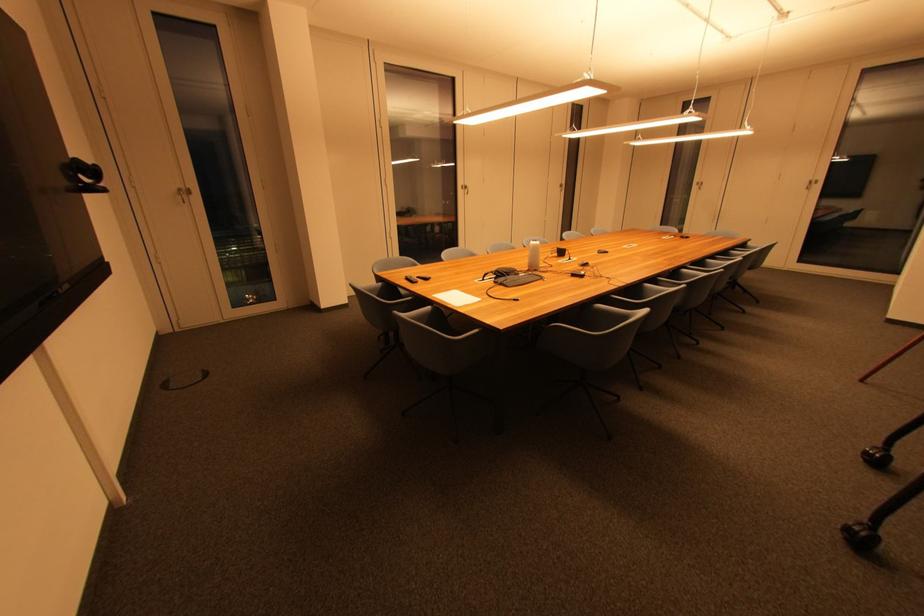
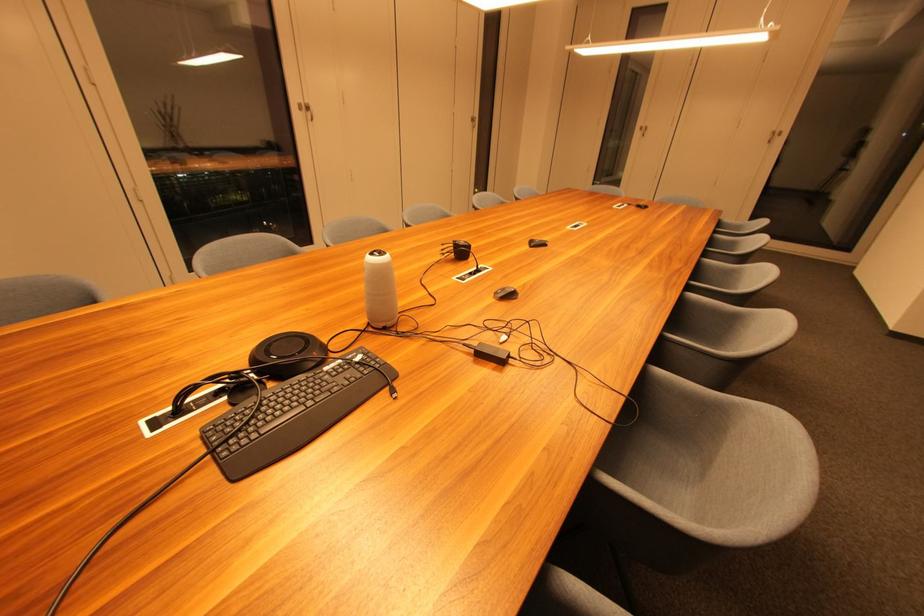
Locate, in the second image, the point that corresponds to point 526,277 in the first image.

(332, 371)